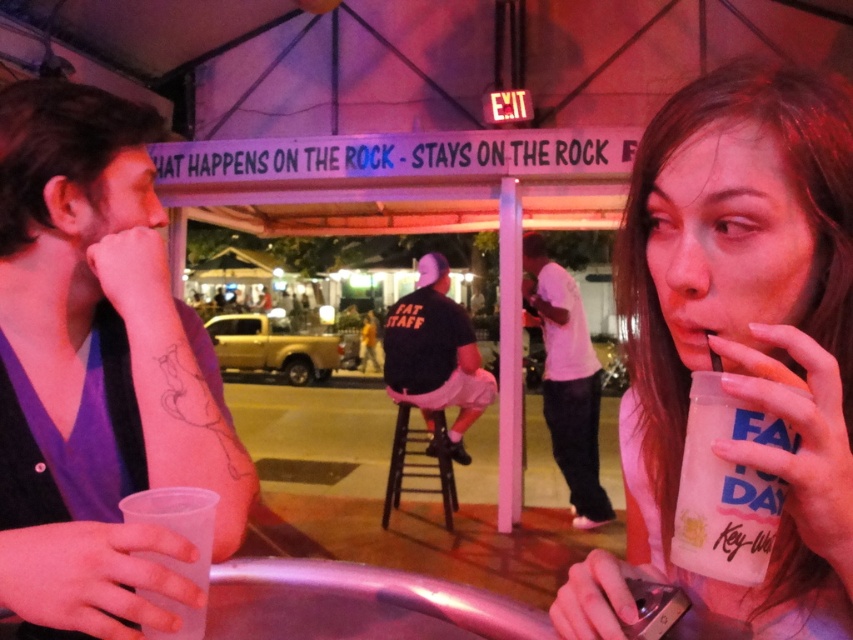
Is clear plastic cup at left shorter than transparent plastic cup at lower left?

No.

Can you confirm if clear plastic cup at left is positioned to the left of transparent plastic cup at lower left?

Correct, you'll find clear plastic cup at left to the left of transparent plastic cup at lower left.

Describe the element at coordinates (96, 365) in the screenshot. Image resolution: width=853 pixels, height=640 pixels. I see `clear plastic cup at left` at that location.

Identify the location of clear plastic cup at left. (96, 365).

Can you confirm if translucent plastic cup at center is positioned above clear plastic cup at left?

Yes.

Between point (676, 282) and point (148, 131), which one is positioned behind?

Positioned behind is point (148, 131).

Which is behind, point (640, 532) or point (61, 161)?

The point (640, 532) is behind.

The image size is (853, 640). What are the coordinates of `translucent plastic cup at center` in the screenshot? It's located at (738, 336).

Is black fabric shirt at center thinner than transparent plastic cup at lower left?

In fact, black fabric shirt at center might be wider than transparent plastic cup at lower left.

Is black fabric shirt at center to the left of transparent plastic cup at lower left from the viewer's perspective?

Incorrect, black fabric shirt at center is not on the left side of transparent plastic cup at lower left.

You are a GUI agent. You are given a task and a screenshot of the screen. Output one action in this format:
    pyautogui.click(x=<x>, y=<y>)
    Task: Click on the black fabric shirt at center
    The height and width of the screenshot is (640, 853).
    Given the screenshot: What is the action you would take?
    pyautogui.click(x=434, y=355)

This screenshot has width=853, height=640. What are the coordinates of `black fabric shirt at center` in the screenshot? It's located at (434, 355).